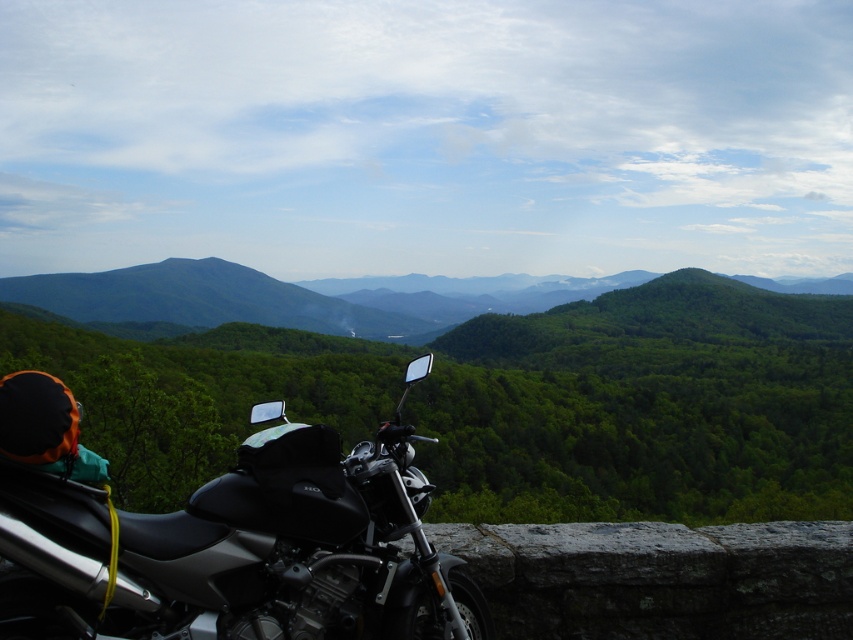
Question: Which point appears closest to the camera in this image?

Choices:
 (A) (671, 337)
 (B) (16, 456)

Answer: (B)

Question: Does green forested mountain at center have a lesser width compared to shiny black motorcycle at lower left?

Choices:
 (A) no
 (B) yes

Answer: (A)

Question: Can you confirm if green forested mountain at center is positioned to the left of shiny black motorcycle at lower left?

Choices:
 (A) yes
 (B) no

Answer: (A)

Question: Observing the image, what is the correct spatial positioning of green forested mountain at center in reference to shiny black motorcycle at lower left?

Choices:
 (A) below
 (B) above

Answer: (B)